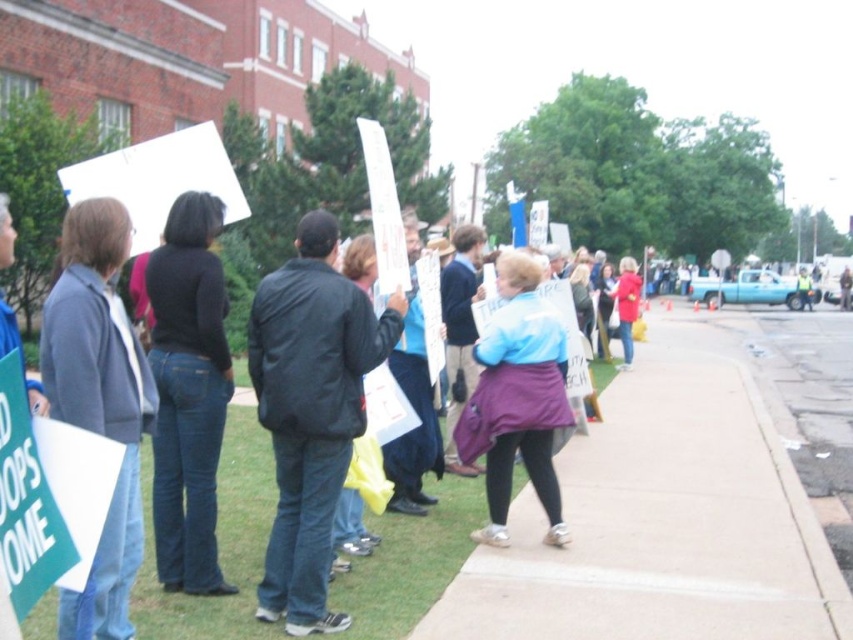
You are a photographer trying to capture a wide shot of the protest scene. You need to ensure that both the paved concrete sidewalk at center and the black leather jacket at center are clearly visible in the frame. Given their sizes, which object should you focus on to ensure both are in focus?

The paved concrete sidewalk at center is larger than the black leather jacket at center, so focusing on the sidewalk will help ensure both objects are in focus as it occupies more space in the frame.

You are a photographer trying to capture both the black leather jacket at center and the purple fabric coat at center in a single frame. Which jacket should you position your camera to the left of to ensure both are in the shot?

You should position your camera to the left of the purple fabric coat at center because the black leather jacket at center is already to the left of it, ensuring both will be captured in the frame.